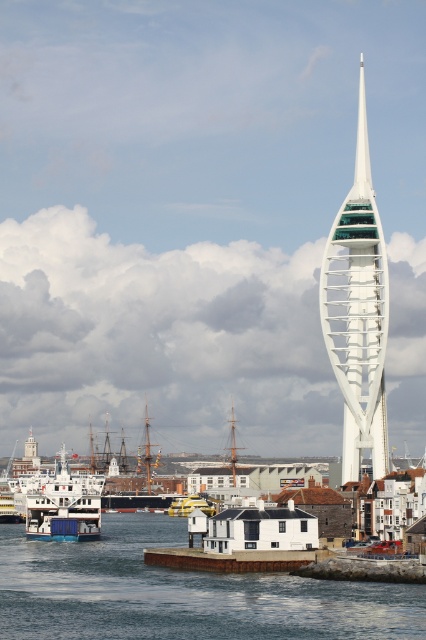
Who is taller, transparent water at lower center or yellow rubber boat at center?

transparent water at lower center

Does transparent water at lower center appear on the left side of yellow rubber boat at center?

Indeed, transparent water at lower center is positioned on the left side of yellow rubber boat at center.

The image size is (426, 640). I want to click on transparent water at lower center, so click(181, 593).

From the picture: Is white metallic tower at center shorter than white glossy ferry at lower left?

Incorrect, white metallic tower at center's height does not fall short of white glossy ferry at lower left's.

Is white metallic tower at center positioned at the back of white glossy ferry at lower left?

Yes, it is.

What do you see at coordinates (357, 310) in the screenshot? The height and width of the screenshot is (640, 426). I see `white metallic tower at center` at bounding box center [357, 310].

Identify the location of white metallic tower at center. (357, 310).

Is transparent water at lower center thinner than white glossy ferry at lower left?

No, transparent water at lower center is not thinner than white glossy ferry at lower left.

Can you confirm if transparent water at lower center is shorter than white glossy ferry at lower left?

No, transparent water at lower center is not shorter than white glossy ferry at lower left.

Identify the location of transparent water at lower center. (181, 593).